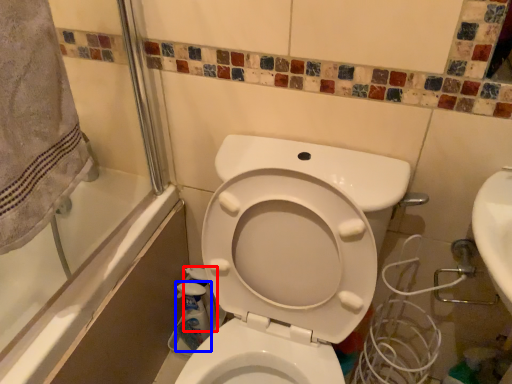
Question: Which object is closer to the camera taking this photo, cleaning product (highlighted by a red box) or cleaning product (highlighted by a blue box)?

Choices:
 (A) cleaning product
 (B) cleaning product

Answer: (B)